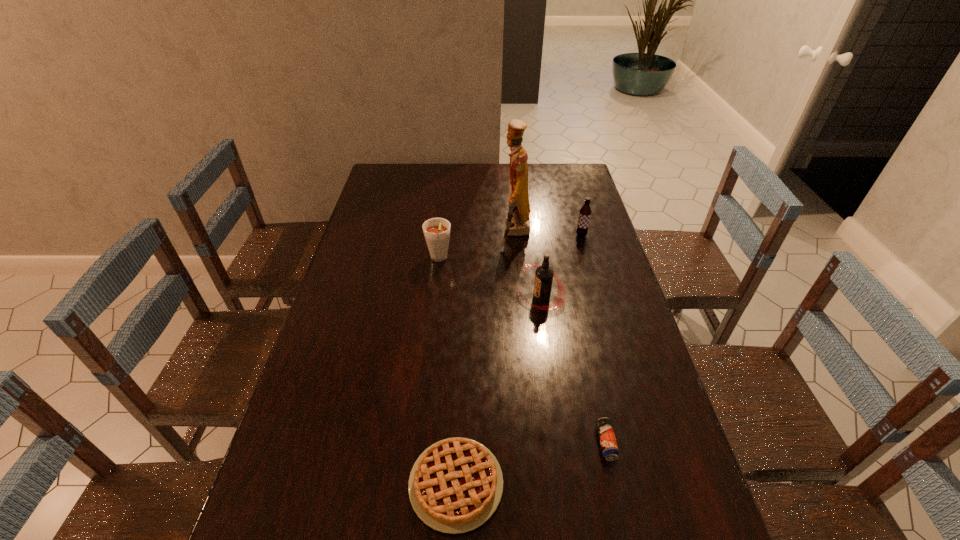
Identify the location of free region at the far edge of the desktop. Image resolution: width=960 pixels, height=540 pixels. (509, 170).

The width and height of the screenshot is (960, 540). In order to click on vacant space at the left edge of the desktop in this screenshot , I will do `click(341, 454)`.

This screenshot has width=960, height=540. I want to click on vacant space at the right edge of the desktop, so click(x=593, y=254).

Where is `vacant space at the far left corner of the desktop`? vacant space at the far left corner of the desktop is located at coordinates pyautogui.click(x=401, y=176).

Locate an element on the screen. empty location between the fifth object from left to right and the second root beer from right to left is located at coordinates (573, 370).

Find the location of a particular element. free space between the pie and the second root beer from left to right is located at coordinates (498, 390).

This screenshot has width=960, height=540. What are the coordinates of `vacant space that is in between the beer can and the rightmost object` in the screenshot? It's located at (593, 339).

Identify the location of free space that is in between the fifth object from left to right and the nutcracker. The width and height of the screenshot is (960, 540). (561, 338).

Where is `free spot between the fifth object from left to right and the pie`? The width and height of the screenshot is (960, 540). free spot between the fifth object from left to right and the pie is located at coordinates (531, 463).

Locate an element on the screen. This screenshot has width=960, height=540. unoccupied area between the pie and the fourth farthest object is located at coordinates (498, 390).